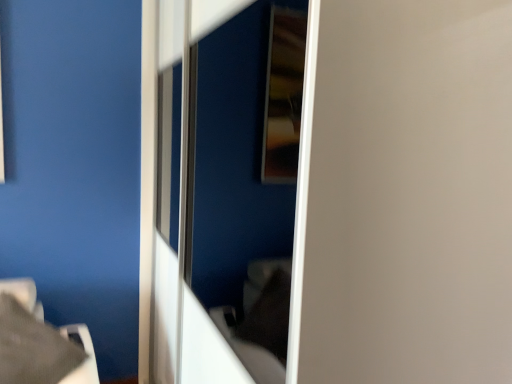
What is the approximate height of satin gray pillow at lower left?

18.37 inches.

What do you see at coordinates (40, 342) in the screenshot? I see `satin gray pillow at lower left` at bounding box center [40, 342].

In order to face satin gray pillow at lower left, should I rotate leftwards or rightwards?

Turn left by 30.442 degrees to look at satin gray pillow at lower left.

This screenshot has width=512, height=384. Identify the location of satin gray pillow at lower left. (40, 342).

Find the location of a particular element. satin gray pillow at lower left is located at coordinates (40, 342).